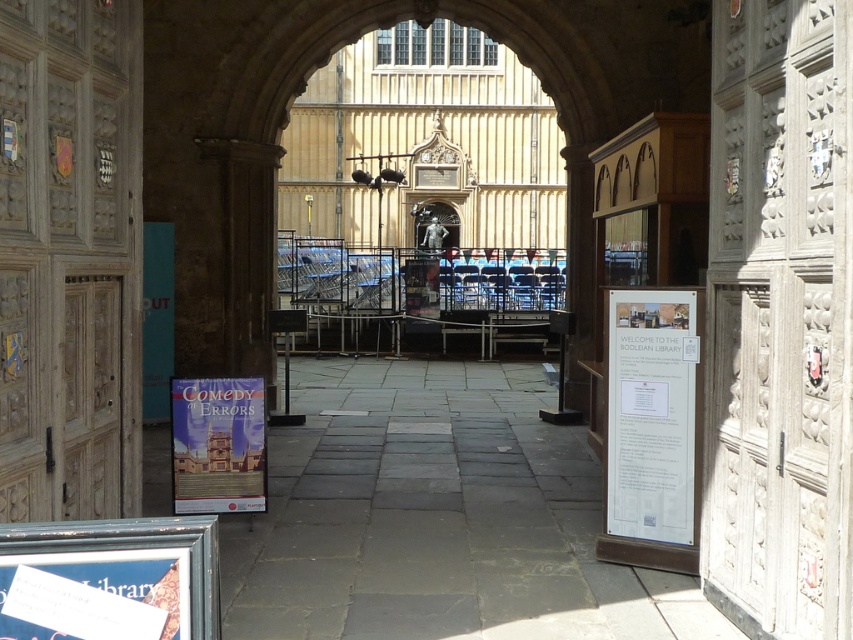
You are a student at the Bodleian Library and need to locate your study materials. You see a white paper at right and a matte paper poster at center. Which object is located to the right of the other?

The white paper at right is positioned on the right side of the matte paper poster at center.

You are a visitor at the Bodleian Library entrance and notice the white paper at right and the matte paper poster at center. Which object is positioned higher in the scene?

The white paper at right is located above the matte paper poster at center, so it is positioned higher in the scene.